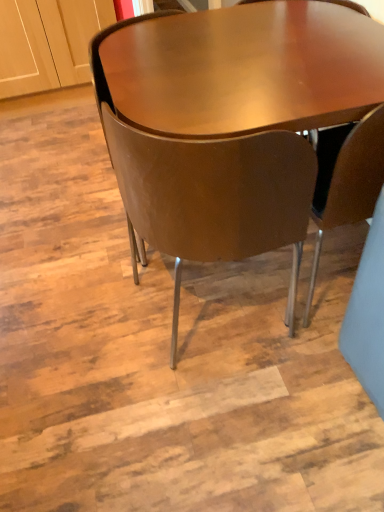
Question: From a real-world perspective, relative to matte brown chair at center, which ranks as the first chair in right-to-left order, is brown leather chair at center, marked as the first chair in a left-to-right arrangement, vertically above or below?

Choices:
 (A) above
 (B) below

Answer: (A)

Question: Is brown leather chair at center, marked as the first chair in a left-to-right arrangement, taller or shorter than matte brown chair at center, which ranks as the 3th chair in left-to-right order?

Choices:
 (A) tall
 (B) short

Answer: (A)

Question: Estimate the real-world distances between objects in this image. Which object is closer to the matte brown chair at center, which ranks as the first chair in right-to-left order?

Choices:
 (A) brown leather chair at center, marked as the first chair in a left-to-right arrangement
 (B) brown leather chair at center, the 2th chair viewed from the right

Answer: (B)

Question: Based on their relative distances, which object is nearer to the brown leather chair at center, the 2th chair viewed from the right?

Choices:
 (A) matte brown chair at center, which ranks as the first chair in right-to-left order
 (B) brown leather chair at center, which ranks as the 3th chair in right-to-left order

Answer: (A)